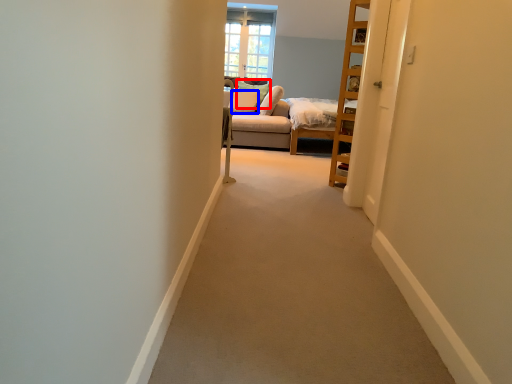
Question: Which of the following is the closest to the observer, pillow (highlighted by a red box) or pillow (highlighted by a blue box)?

Choices:
 (A) pillow
 (B) pillow

Answer: (B)